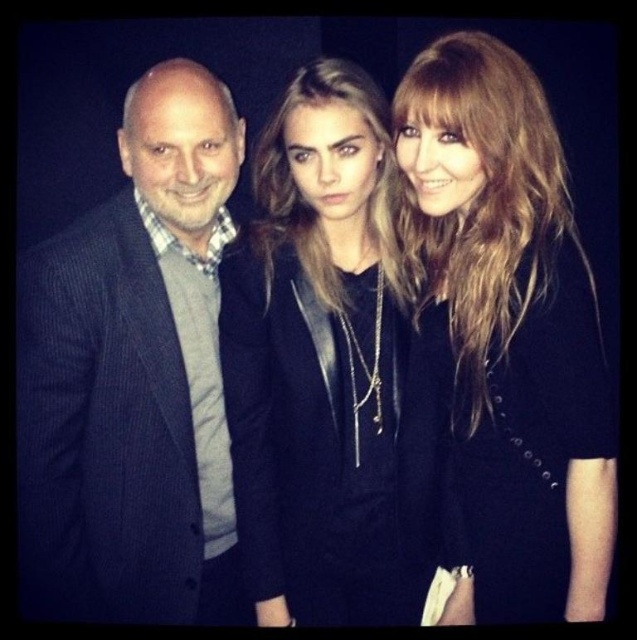
Can you confirm if dark pinstriped suit at left is positioned to the left of shiny black coat at center?

Indeed, dark pinstriped suit at left is positioned on the left side of shiny black coat at center.

Looking at this image, can you confirm if dark pinstriped suit at left is positioned above shiny black coat at center?

No.

Where is `dark pinstriped suit at left`? This screenshot has width=637, height=640. dark pinstriped suit at left is located at coordinates (134, 380).

Which is in front, point (50, 609) or point (257, 384)?

Positioned in front is point (257, 384).

Is dark pinstriped suit at left to the right of black leather jacket at center from the viewer's perspective?

Incorrect, dark pinstriped suit at left is not on the right side of black leather jacket at center.

Describe the element at coordinates (134, 380) in the screenshot. I see `dark pinstriped suit at left` at that location.

I want to click on dark pinstriped suit at left, so click(134, 380).

Which is more to the right, shiny black coat at center or black leather jacket at center?

shiny black coat at center

Can you confirm if shiny black coat at center is taller than black leather jacket at center?

Yes, shiny black coat at center is taller than black leather jacket at center.

Which is behind, point (555, 435) or point (283, 365)?

Point (283, 365)

Find the location of `shiny black coat at center`. shiny black coat at center is located at coordinates pos(505,337).